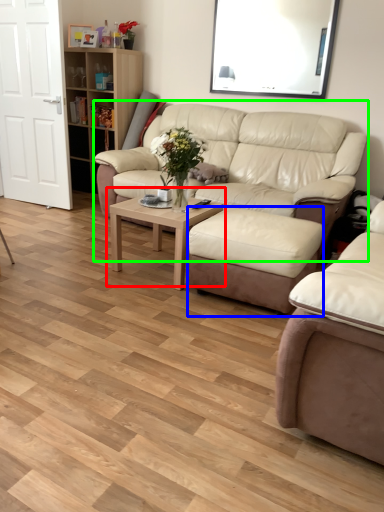
Question: Considering the real-world distances, which object is closest to coffee table (highlighted by a red box)? stool (highlighted by a blue box) or studio couch (highlighted by a green box).

Choices:
 (A) stool
 (B) studio couch

Answer: (A)